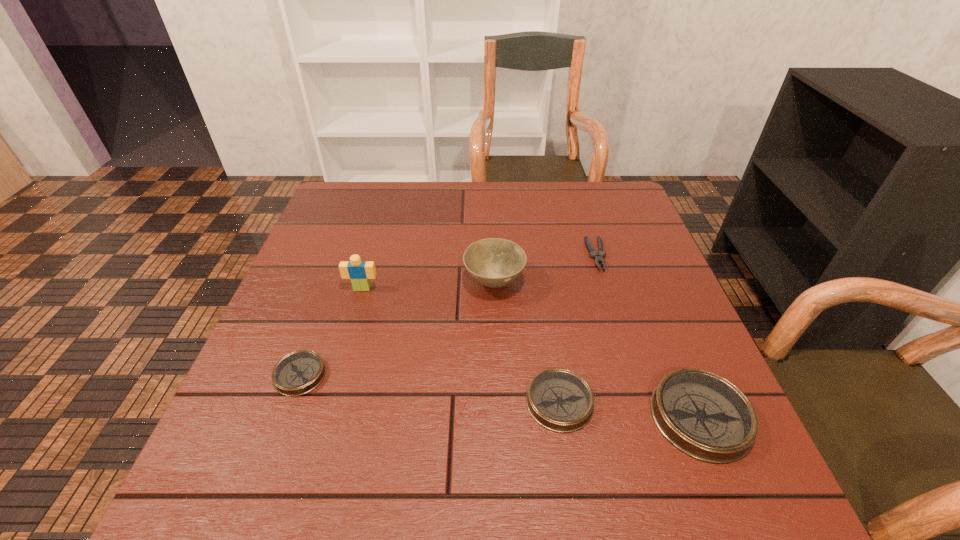
Please point a spot to place another compass for symmetrical spacing. Please provide its 2D coordinates. Your answer should be formatted as a tuple, i.e. [(x, y)], where the tuple contains the x and y coordinates of a point satisfying the conditions above.

[(426, 388)]